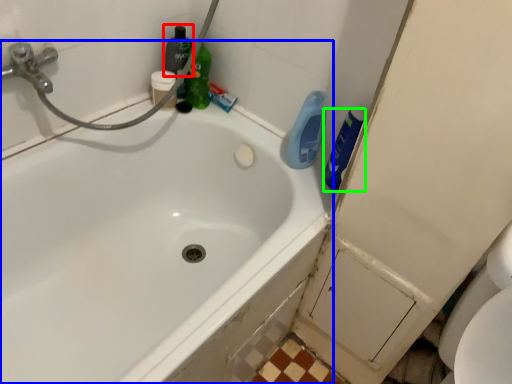
Question: Based on their relative distances, which object is nearer to cleaning product (highlighted by a red box)? Choose from bathtub (highlighted by a blue box) and cleaning product (highlighted by a green box).

Choices:
 (A) bathtub
 (B) cleaning product

Answer: (B)